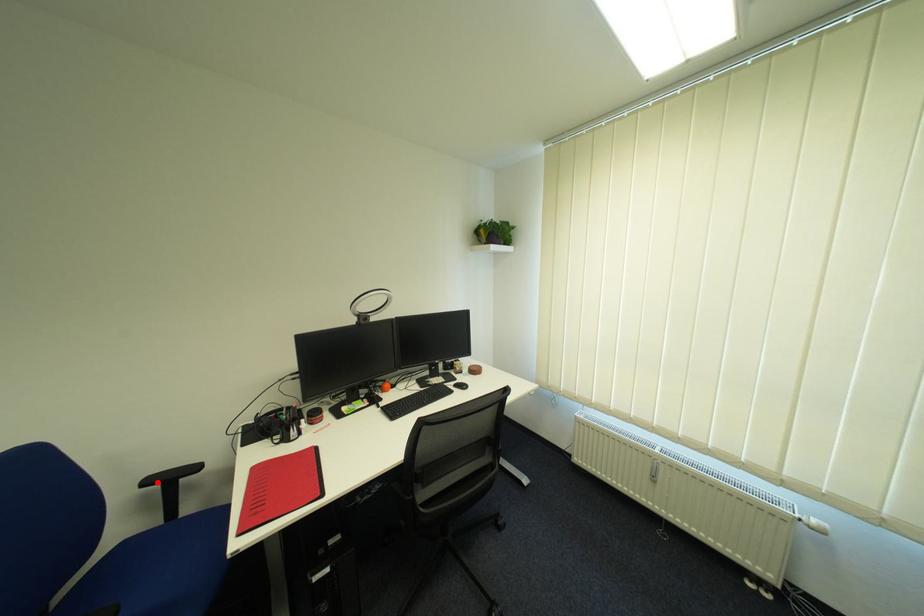
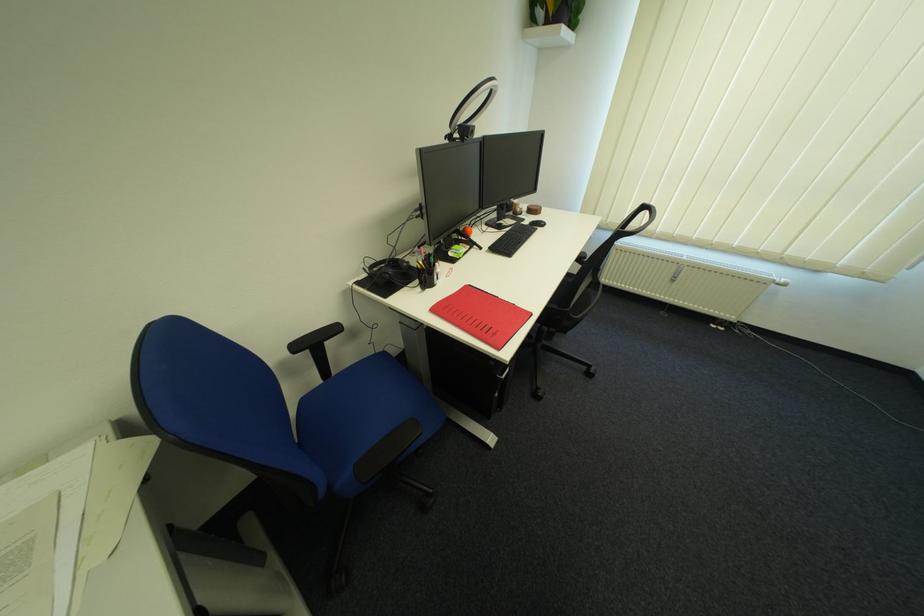
Question: I am providing you with two images of the same scene from different viewpoints. A red point is shown in image1. For the corresponding object point in image2, is it positioned nearer or farther from the camera?

Choices:
 (A) Nearer
 (B) Farther

Answer: (B)